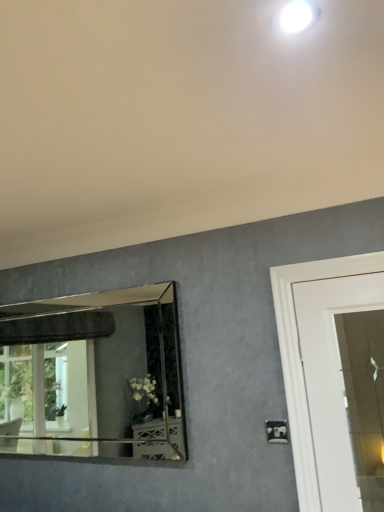
The image size is (384, 512). What do you see at coordinates (276, 431) in the screenshot?
I see `white plastic light switch at lower right` at bounding box center [276, 431].

Find the location of a particular element. This screenshot has width=384, height=512. white glossy droplight at upper center is located at coordinates (295, 17).

Locate an element on the screen. This screenshot has height=512, width=384. silver-framed mirror at left is located at coordinates (92, 375).

Locate an element on the screen. The height and width of the screenshot is (512, 384). white plastic light switch at lower right is located at coordinates (276, 431).

How different are the orientations of white glossy droplight at upper center and silver-framed mirror at left in degrees?

There is a 0.749-degree angle between the facing directions of white glossy droplight at upper center and silver-framed mirror at left.

From the picture: Is white glossy droplight at upper center facing away from silver-framed mirror at left?

No, white glossy droplight at upper center's orientation is not away from silver-framed mirror at left.

In terms of size, does white glossy droplight at upper center appear bigger or smaller than silver-framed mirror at left?

Clearly, white glossy droplight at upper center is smaller in size than silver-framed mirror at left.

Is white plastic light switch at lower right directly adjacent to white glossy droplight at upper center?

No, white plastic light switch at lower right is not with white glossy droplight at upper center.

I want to click on droplight located on the left of white plastic light switch at lower right, so click(295, 17).

Does point (270, 425) lie in front of point (288, 20)?

No, (270, 425) is further to viewer.

Who is more distant, white plastic light switch at lower right or white glossy droplight at upper center?

white plastic light switch at lower right is more distant.

Is white plastic light switch at lower right facing away from silver-framed mirror at left?

That's not correct — white plastic light switch at lower right is not looking away from silver-framed mirror at left.

Which is closer to the camera, (284, 440) or (2, 377)?

Point (284, 440)

Would you consider white plastic light switch at lower right to be distant from silver-framed mirror at left?

white plastic light switch at lower right is positioned a significant distance from silver-framed mirror at left.

Consider the image. Would you say white plastic light switch at lower right contains silver-framed mirror at left?

Definitely not — silver-framed mirror at left is not inside white plastic light switch at lower right.

From the image's perspective, relative to white plastic light switch at lower right, is white glossy droplight at upper center above or below?

white glossy droplight at upper center is situated higher than white plastic light switch at lower right in the image.

Considering the relative sizes of white glossy droplight at upper center and white plastic light switch at lower right in the image provided, is white glossy droplight at upper center wider than white plastic light switch at lower right?

Yes.

This screenshot has width=384, height=512. What are the coordinates of `light switch below the white glossy droplight at upper center (from the image's perspective)` in the screenshot? It's located at (x=276, y=431).

Is silver-framed mirror at left beside white glossy droplight at upper center?

silver-framed mirror at left is not next to white glossy droplight at upper center, and they're not touching.

From the image's perspective, is silver-framed mirror at left on top of white glossy droplight at upper center?

No, from the image's perspective, silver-framed mirror at left is not over white glossy droplight at upper center.

From a real-world perspective, does silver-framed mirror at left sit lower than white glossy droplight at upper center?

Yes, from a real-world perspective, silver-framed mirror at left is below white glossy droplight at upper center.

Which is correct: silver-framed mirror at left is inside white glossy droplight at upper center, or outside of it?

silver-framed mirror at left is not enclosed by white glossy droplight at upper center.

The image size is (384, 512). Find the location of `mirror above the white plastic light switch at lower right (from a real-world perspective)`. mirror above the white plastic light switch at lower right (from a real-world perspective) is located at coordinates (92, 375).

Which object is positioned more to the right, silver-framed mirror at left or white plastic light switch at lower right?

white plastic light switch at lower right is more to the right.

Is there a large distance between silver-framed mirror at left and white plastic light switch at lower right?

Indeed, silver-framed mirror at left is not near white plastic light switch at lower right.

At what (x,y) coordinates should I click in order to perform the action: click on mirror below the white glossy droplight at upper center (from the image's perspective). Please return your answer as a coordinate pair (x, y). Looking at the image, I should click on (92, 375).

At what (x,y) coordinates should I click in order to perform the action: click on droplight that appears above the white plastic light switch at lower right (from a real-world perspective). Please return your answer as a coordinate pair (x, y). The image size is (384, 512). Looking at the image, I should click on (295, 17).

Looking at this image, looking at the image, which one is located closer to silver-framed mirror at left, white plastic light switch at lower right or white glossy droplight at upper center?

white plastic light switch at lower right is closer to silver-framed mirror at left.

Which object lies further to the anchor point white plastic light switch at lower right, white glossy droplight at upper center or silver-framed mirror at left?

Among the two, silver-framed mirror at left is located further to white plastic light switch at lower right.

Considering their positions, is white plastic light switch at lower right positioned closer to white glossy droplight at upper center than silver-framed mirror at left?

white plastic light switch at lower right is closer to white glossy droplight at upper center.

From the image, which object appears to be farther from silver-framed mirror at left, white glossy droplight at upper center or white plastic light switch at lower right?

white glossy droplight at upper center is positioned further to the anchor silver-framed mirror at left.

From the image, which object appears to be nearer to white plastic light switch at lower right, silver-framed mirror at left or white glossy droplight at upper center?

white glossy droplight at upper center.

Considering their positions, is silver-framed mirror at left positioned further to white glossy droplight at upper center than white plastic light switch at lower right?

silver-framed mirror at left lies further to white glossy droplight at upper center than the other object.

Find the location of `mirror between white glossy droplight at upper center and white plastic light switch at lower right in the up-down direction`. mirror between white glossy droplight at upper center and white plastic light switch at lower right in the up-down direction is located at coordinates (92, 375).